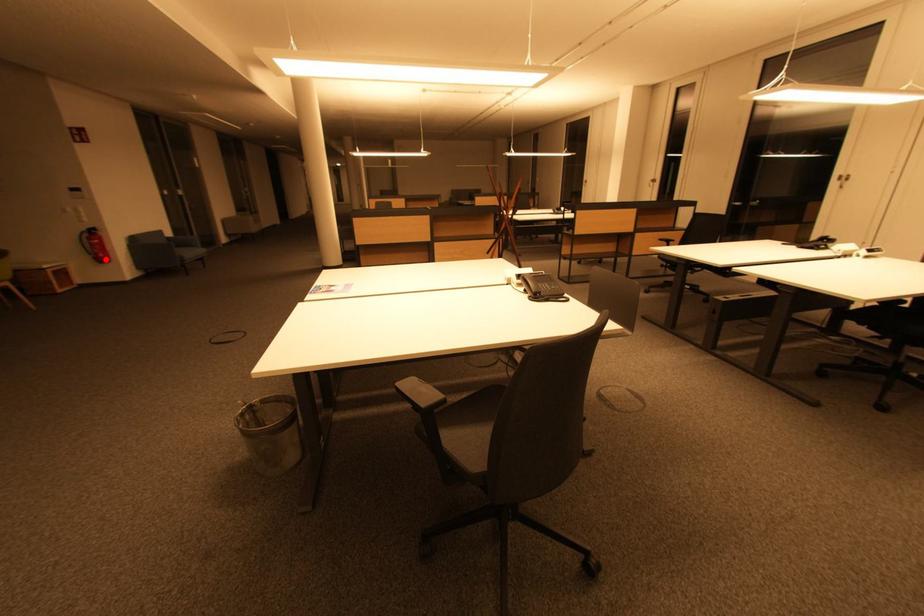
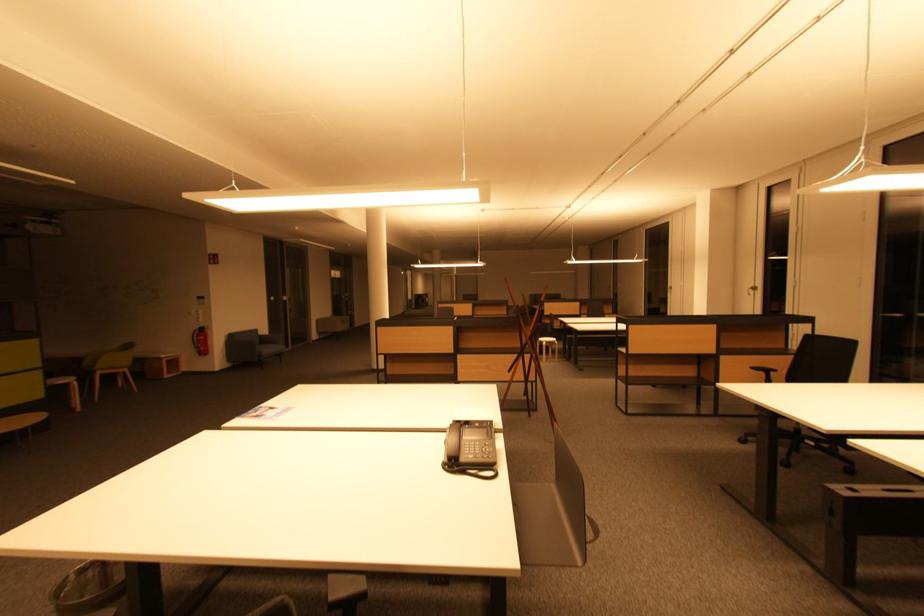
Question: I am providing you with two images of the same scene from different viewpoints. Given a red point in image1, look at the same physical point in image2. Is it:

Choices:
 (A) Closer to the viewpoint
 (B) Farther from the viewpoint

Answer: (A)